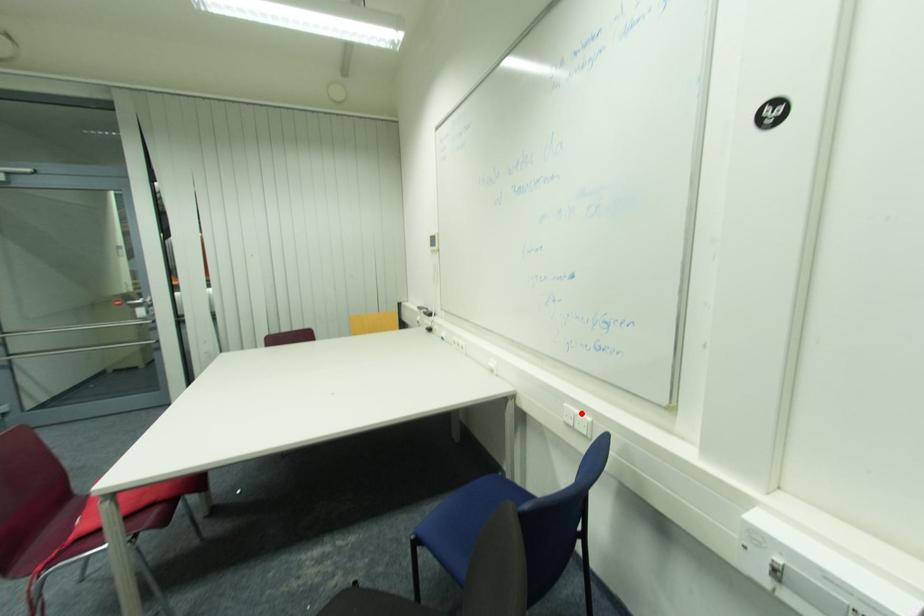
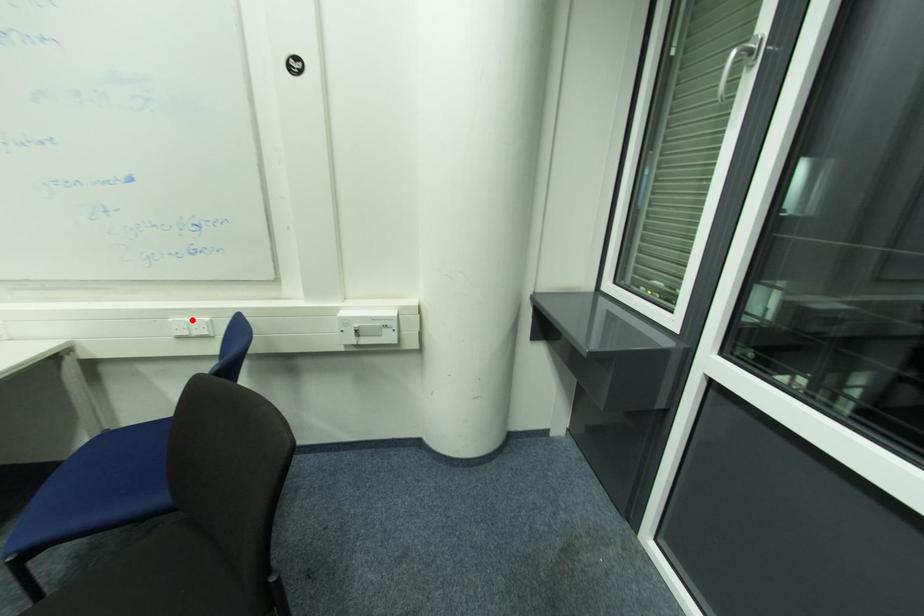
I am providing you with two images of the same scene from different viewpoints. A red point is marked on the first image and another point is marked on the second image. Does the point marked in image1 correspond to the same location as the one in image2?

Yes